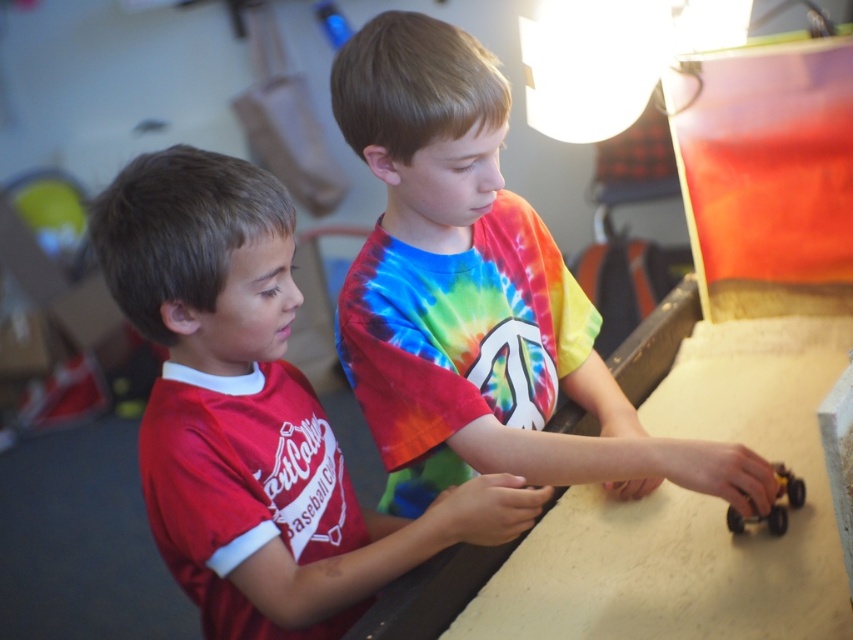
Find the location of `matte red shirt at left`. matte red shirt at left is located at coordinates (253, 412).

Does matte red shirt at left appear under metallic yellow toy car at lower right?

No, matte red shirt at left is not below metallic yellow toy car at lower right.

Between point (152, 468) and point (804, 496), which one is positioned behind?

Positioned behind is point (804, 496).

Locate an element on the screen. The image size is (853, 640). matte red shirt at left is located at coordinates (253, 412).

This screenshot has width=853, height=640. What do you see at coordinates (479, 298) in the screenshot? I see `rainbow tie-dye shirt at center` at bounding box center [479, 298].

Where is `rainbow tie-dye shirt at center`? rainbow tie-dye shirt at center is located at coordinates (479, 298).

Describe the element at coordinates (479, 298) in the screenshot. This screenshot has width=853, height=640. I see `rainbow tie-dye shirt at center` at that location.

Locate an element on the screen. This screenshot has height=640, width=853. rainbow tie-dye shirt at center is located at coordinates click(x=479, y=298).

Does point (408, 348) lie in front of point (189, 468)?

No, (408, 348) is behind (189, 468).

At what (x,y) coordinates should I click in order to perform the action: click on rainbow tie-dye shirt at center. Please return your answer as a coordinate pair (x, y). Looking at the image, I should click on (479, 298).